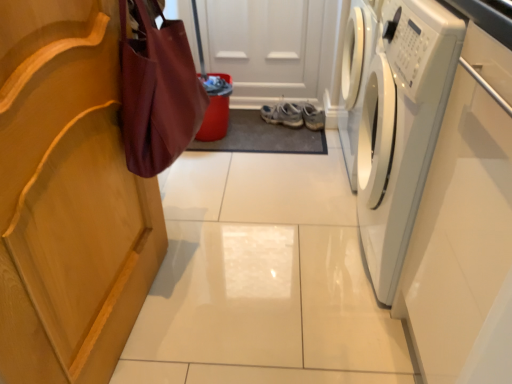
Question: Is burgundy fabric bag at left oriented towards white glossy washing machine at right?

Choices:
 (A) yes
 (B) no

Answer: (A)

Question: Is white glossy washing machine at right located within burgundy fabric bag at left?

Choices:
 (A) yes
 (B) no

Answer: (B)

Question: From the image's perspective, is burgundy fabric bag at left located beneath white glossy washing machine at right?

Choices:
 (A) yes
 (B) no

Answer: (B)

Question: Is burgundy fabric bag at left wider than white glossy washing machine at right?

Choices:
 (A) yes
 (B) no

Answer: (B)

Question: Does burgundy fabric bag at left appear on the right side of white glossy washing machine at right?

Choices:
 (A) no
 (B) yes

Answer: (A)

Question: Is white glossy washing machine at right wider or thinner than light blue fabric sneakers at center?

Choices:
 (A) thin
 (B) wide

Answer: (B)

Question: Based on their positions, is white glossy washing machine at right located to the left or right of light blue fabric sneakers at center?

Choices:
 (A) left
 (B) right

Answer: (B)

Question: From a real-world perspective, is white glossy washing machine at right physically located above or below light blue fabric sneakers at center?

Choices:
 (A) below
 (B) above

Answer: (B)

Question: Is white glossy washing machine at right inside or outside of light blue fabric sneakers at center?

Choices:
 (A) outside
 (B) inside

Answer: (A)

Question: Relative to white glossy washing machine at right, is light blue fabric sneakers at center in front or behind?

Choices:
 (A) front
 (B) behind

Answer: (B)

Question: Is point (296, 122) positioned closer to the camera than point (360, 215)?

Choices:
 (A) closer
 (B) farther

Answer: (B)

Question: Is light blue fabric sneakers at center taller or shorter than white glossy washing machine at right?

Choices:
 (A) tall
 (B) short

Answer: (B)

Question: Is light blue fabric sneakers at center bigger or smaller than white glossy washing machine at right?

Choices:
 (A) big
 (B) small

Answer: (B)

Question: Based on their sizes in the image, would you say light blue fabric sneakers at center is bigger or smaller than burgundy fabric bag at left?

Choices:
 (A) big
 (B) small

Answer: (B)

Question: In terms of height, does light blue fabric sneakers at center look taller or shorter compared to burgundy fabric bag at left?

Choices:
 (A) tall
 (B) short

Answer: (B)